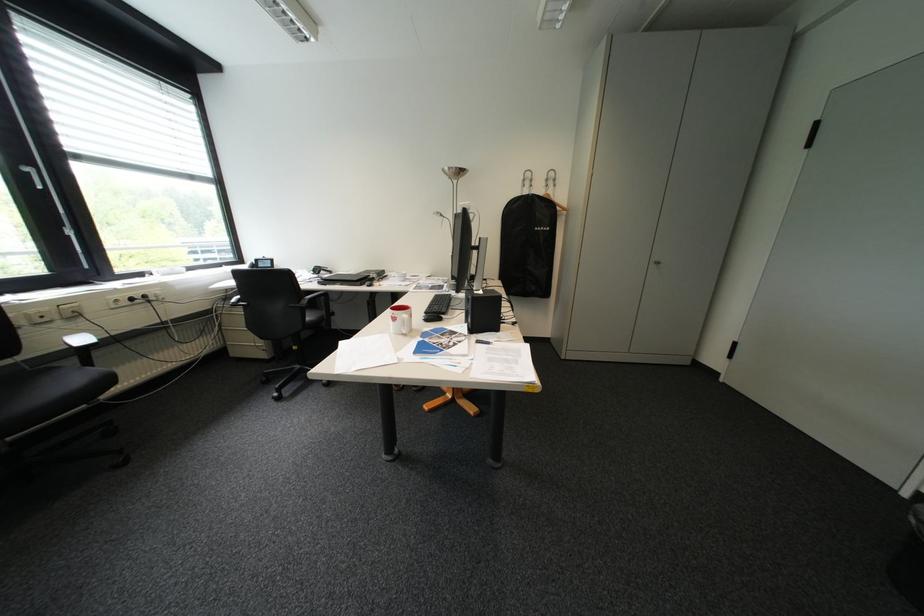
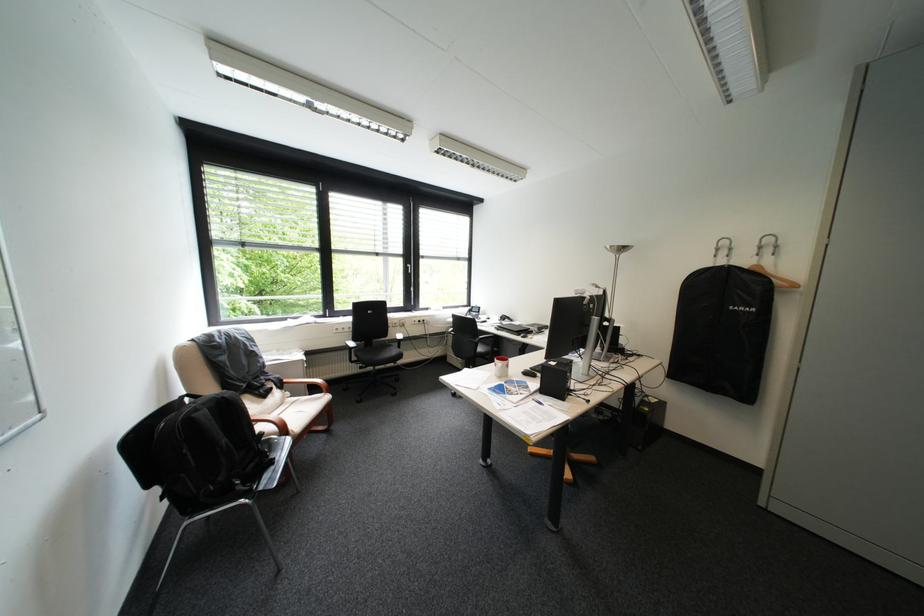
The point at (566, 180) is marked in the first image. Where is the corresponding point in the second image?

(788, 246)